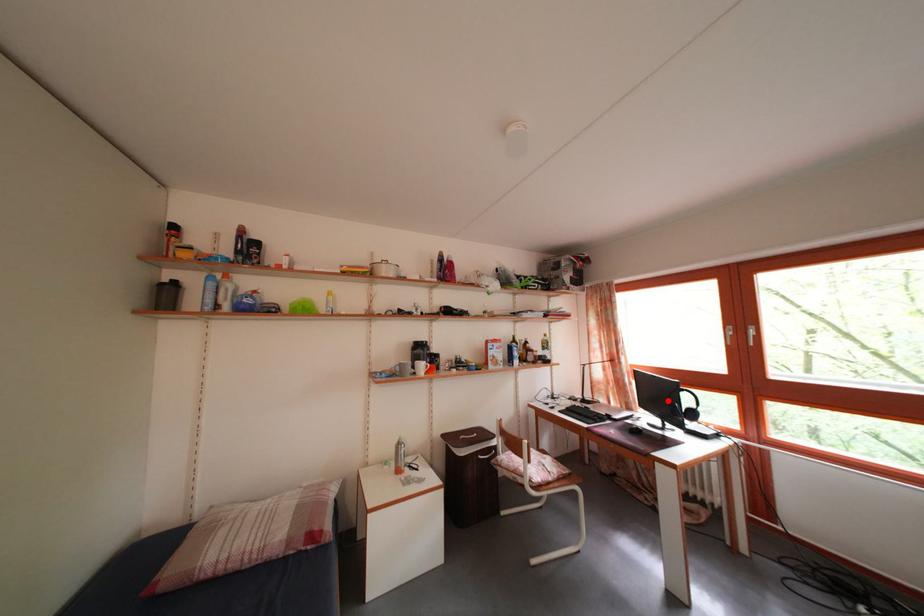
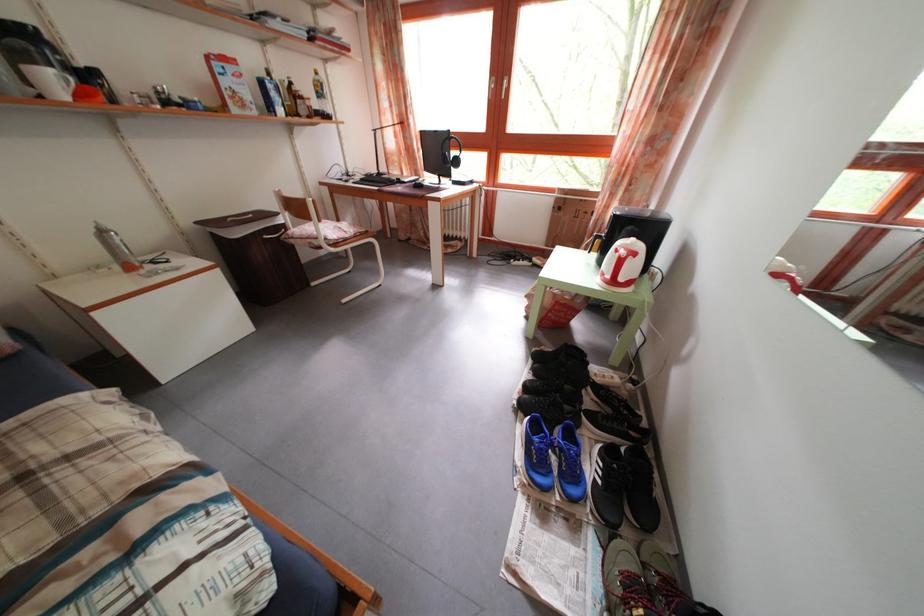
Where in the second image is the point corresponding to the highlighted location from the first image?

(446, 160)